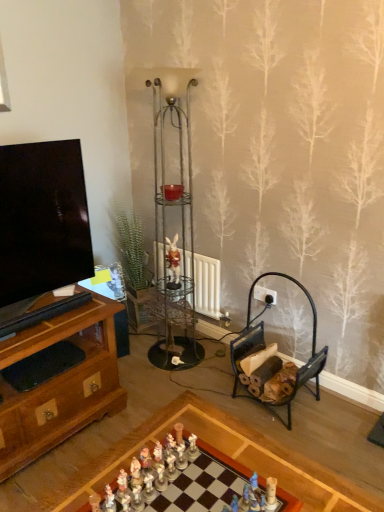
The image size is (384, 512). I want to click on free space on the front side of white porcelain figurines at center, the third toy viewed from the front, so click(186, 494).